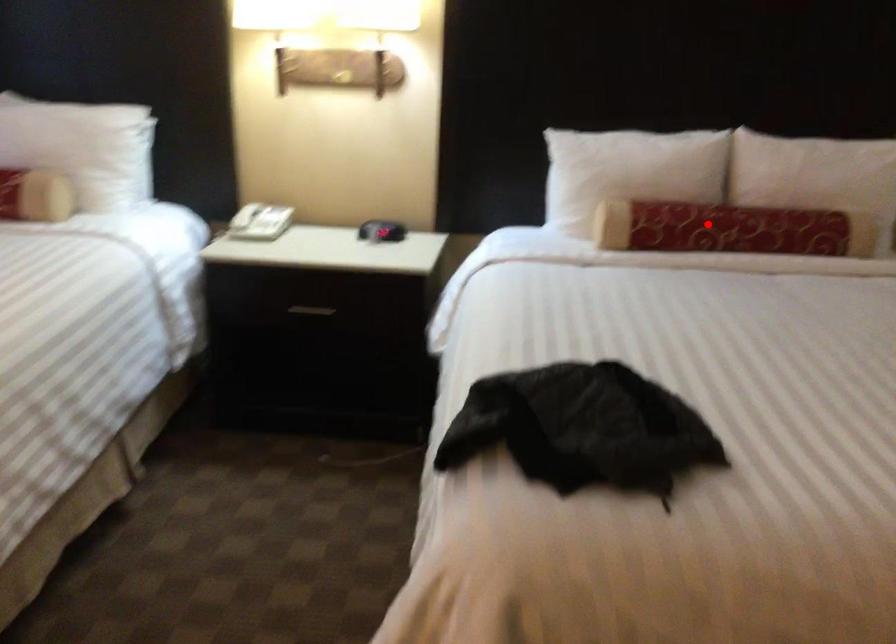
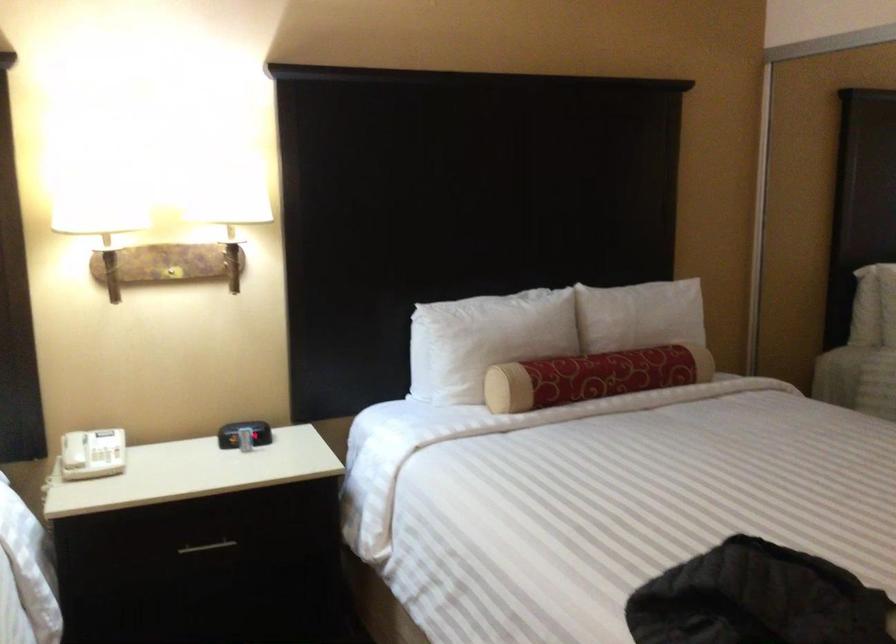
In the second image, find the point that corresponds to the highlighted location in the first image.

(592, 377)